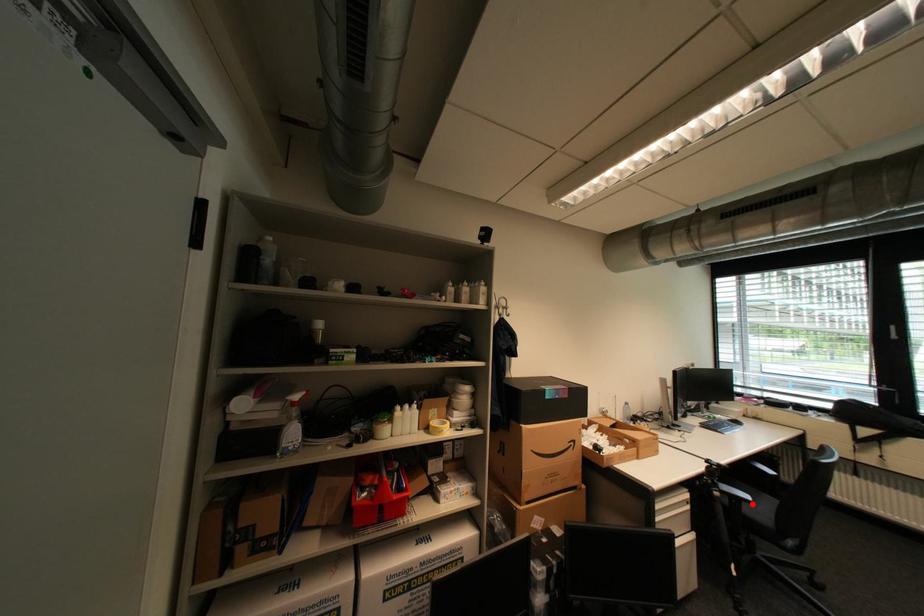
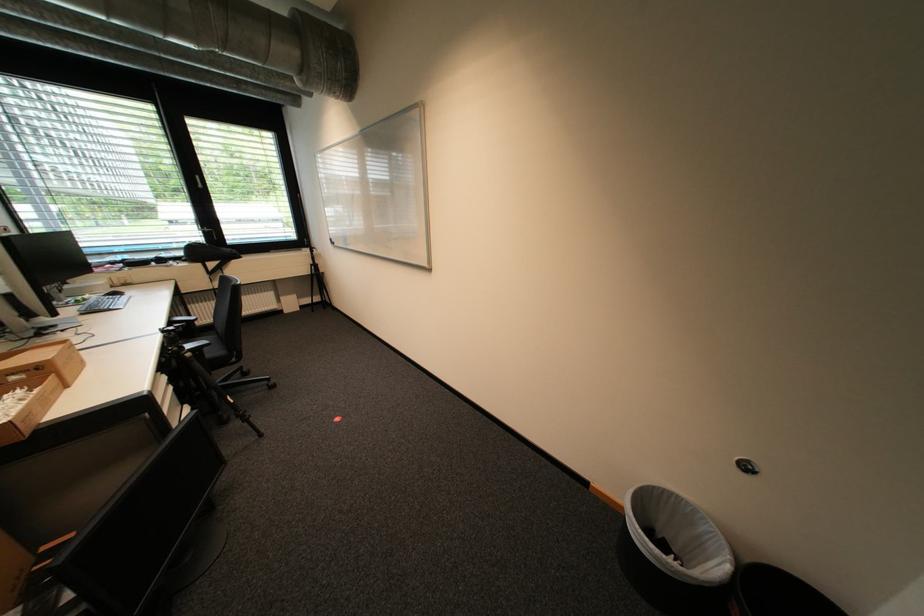
The point at the highlighted location is marked in the first image. Where is the corresponding point in the second image?

(213, 350)